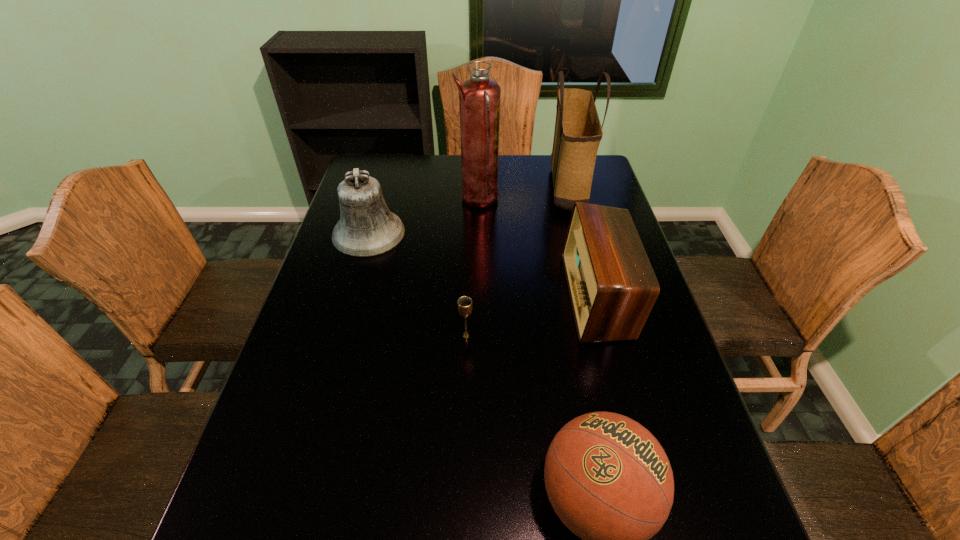
This screenshot has width=960, height=540. Find the location of `free region that satisfies the following two spatial constraints: 1. on the back side of the chalice; 2. on the right side of the tote bag`. free region that satisfies the following two spatial constraints: 1. on the back side of the chalice; 2. on the right side of the tote bag is located at coordinates (470, 186).

This screenshot has width=960, height=540. Find the location of `vacant space that satisfies the following two spatial constraints: 1. on the front-facing side of the radio receiver; 2. on the front side of the shortest object`. vacant space that satisfies the following two spatial constraints: 1. on the front-facing side of the radio receiver; 2. on the front side of the shortest object is located at coordinates (608, 336).